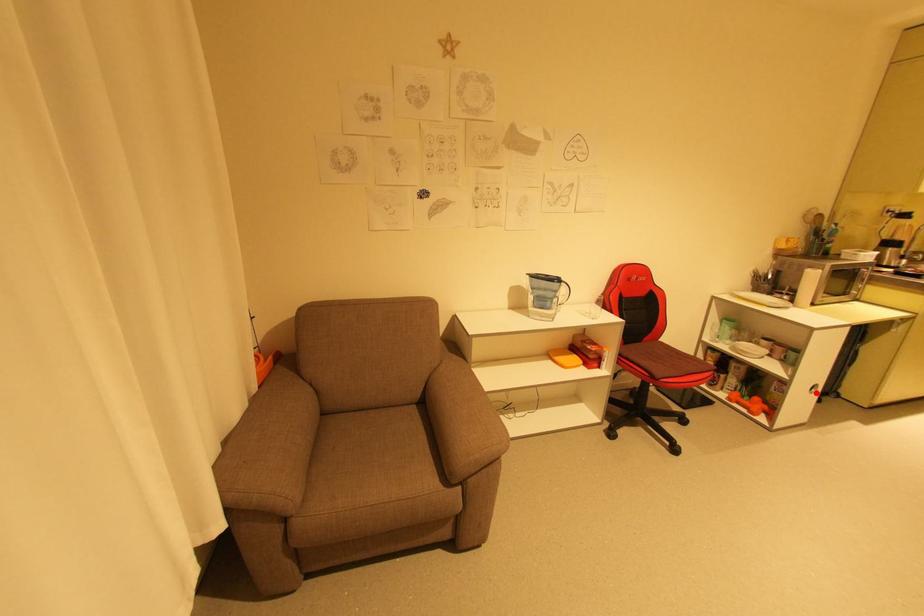
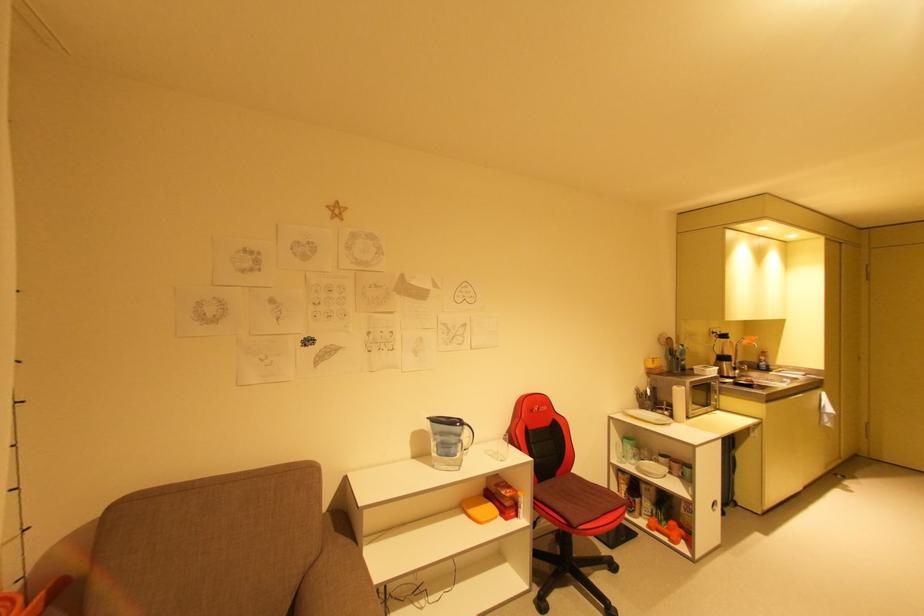
Question: I am providing you with two images of the same scene from different viewpoints. In image1, a red point is highlighted. Considering the same 3D point in image2, which of the following is correct?

Choices:
 (A) It is closer
 (B) It is farther

Answer: (A)